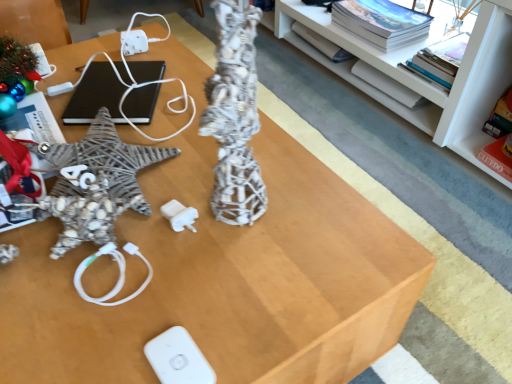
Question: Does white glossy shelf at upper center have a smaller size compared to shiny metallic ornament at upper left?

Choices:
 (A) no
 (B) yes

Answer: (A)

Question: Considering the relative positions of white glossy shelf at upper center and shiny metallic ornament at upper left in the image provided, is white glossy shelf at upper center behind shiny metallic ornament at upper left?

Choices:
 (A) yes
 (B) no

Answer: (B)

Question: Does white glossy shelf at upper center have a lesser height compared to shiny metallic ornament at upper left?

Choices:
 (A) yes
 (B) no

Answer: (B)

Question: Is there a large distance between white glossy shelf at upper center and shiny metallic ornament at upper left?

Choices:
 (A) yes
 (B) no

Answer: (A)

Question: Can you confirm if white glossy shelf at upper center is bigger than shiny metallic ornament at upper left?

Choices:
 (A) no
 (B) yes

Answer: (B)

Question: Is white glossy shelf at upper center spatially inside shiny metallic ornament at upper left, or outside of it?

Choices:
 (A) inside
 (B) outside

Answer: (B)

Question: Is point (415, 114) positioned closer to the camera than point (7, 81)?

Choices:
 (A) closer
 (B) farther

Answer: (B)

Question: From a real-world perspective, is white glossy shelf at upper center positioned above or below shiny metallic ornament at upper left?

Choices:
 (A) above
 (B) below

Answer: (B)

Question: Looking at the image, does white glossy shelf at upper center seem bigger or smaller compared to shiny metallic ornament at upper left?

Choices:
 (A) big
 (B) small

Answer: (A)

Question: From the image's perspective, is white matte wii controller at lower center located above or below black matte laptop at upper left?

Choices:
 (A) below
 (B) above

Answer: (A)

Question: Does point (190, 350) appear closer or farther from the camera than point (132, 112)?

Choices:
 (A) farther
 (B) closer

Answer: (B)

Question: From a real-world perspective, is white matte wii controller at lower center above or below black matte laptop at upper left?

Choices:
 (A) below
 (B) above

Answer: (A)

Question: Is white matte wii controller at lower center situated inside black matte laptop at upper left or outside?

Choices:
 (A) outside
 (B) inside

Answer: (A)

Question: Does point (130, 109) appear closer or farther from the camera than point (467, 117)?

Choices:
 (A) farther
 (B) closer

Answer: (B)

Question: Is black matte laptop at upper left spatially inside white glossy shelf at upper center, or outside of it?

Choices:
 (A) outside
 (B) inside

Answer: (A)